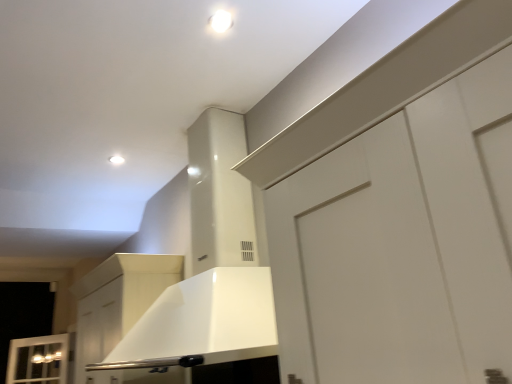
Question: Is white matte cabinet at center not within white glossy light fixture at upper center, the 1th lighting from the top?

Choices:
 (A) yes
 (B) no

Answer: (A)

Question: Is white matte cabinet at center positioned with its back to white glossy light fixture at upper center, the 1th lighting from the top?

Choices:
 (A) yes
 (B) no

Answer: (B)

Question: Is white matte cabinet at center far from white glossy light fixture at upper center, the 1th lighting from the top?

Choices:
 (A) no
 (B) yes

Answer: (B)

Question: Is white matte cabinet at center to the left of white glossy light fixture at upper center, the 2th lighting when ordered from left to right, from the viewer's perspective?

Choices:
 (A) no
 (B) yes

Answer: (B)

Question: Is white matte cabinet at center further to the viewer compared to white glossy light fixture at upper center, which is counted as the second lighting, starting from the back?

Choices:
 (A) no
 (B) yes

Answer: (B)

Question: Which is correct: white glossy light fixture at upper center, which is the second lighting in right-to-left order, is inside white matte cabinet at center, or outside of it?

Choices:
 (A) outside
 (B) inside

Answer: (A)

Question: From a real-world perspective, is white glossy light fixture at upper center, acting as the first lighting starting from the back, physically located above or below white matte cabinet at center?

Choices:
 (A) above
 (B) below

Answer: (A)

Question: Is white glossy light fixture at upper center, acting as the first lighting starting from the back, to the left or to the right of white matte cabinet at center in the image?

Choices:
 (A) left
 (B) right

Answer: (B)

Question: Considering their positions, is white glossy light fixture at upper center, acting as the first lighting starting from the back, located in front of or behind white matte cabinet at center?

Choices:
 (A) front
 (B) behind

Answer: (B)

Question: Is white matte cabinet at center wider or thinner than white glossy light fixture at upper center, acting as the second lighting starting from the bottom?

Choices:
 (A) wide
 (B) thin

Answer: (A)

Question: From a real-world perspective, relative to white glossy light fixture at upper center, which appears as the first lighting when viewed from the right, is white matte cabinet at center vertically above or below?

Choices:
 (A) above
 (B) below

Answer: (B)

Question: In terms of size, does white matte cabinet at center appear bigger or smaller than white glossy light fixture at upper center, which appears as the first lighting when viewed from the right?

Choices:
 (A) big
 (B) small

Answer: (A)

Question: In terms of height, does white matte cabinet at center look taller or shorter compared to white glossy light fixture at upper center, the 1th lighting from the top?

Choices:
 (A) short
 (B) tall

Answer: (B)

Question: Choose the correct answer: Is white glossy light fixture at upper center, which is the second lighting in right-to-left order, inside white glossy light fixture at upper center, acting as the second lighting starting from the bottom, or outside it?

Choices:
 (A) outside
 (B) inside

Answer: (A)

Question: Based on their sizes in the image, would you say white glossy light fixture at upper center, the 1th lighting from the left, is bigger or smaller than white glossy light fixture at upper center, which appears as the first lighting when viewed from the right?

Choices:
 (A) small
 (B) big

Answer: (A)